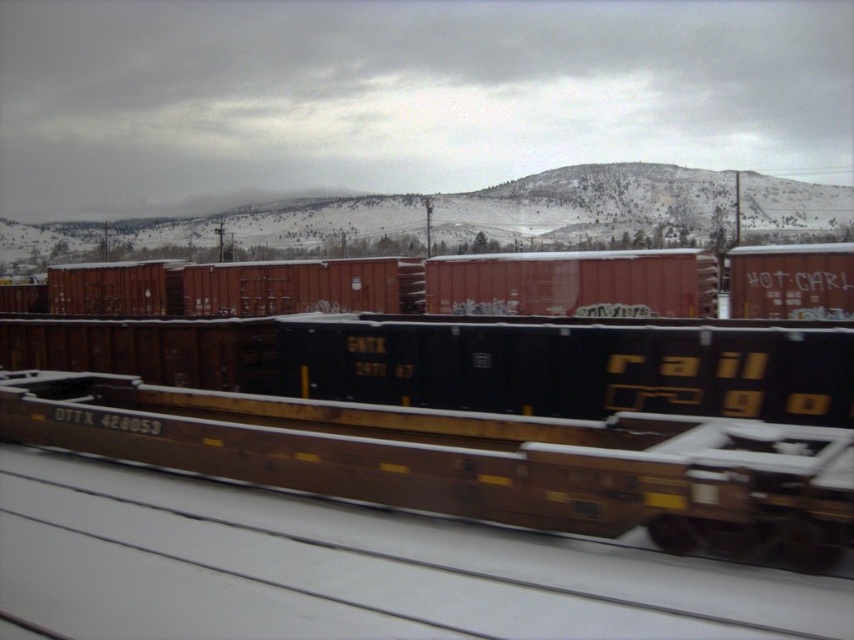
Is point (297, 388) more distant than point (295, 262)?

That is False.

Find the location of a particular element. The height and width of the screenshot is (640, 854). rusty metal train car at center is located at coordinates (471, 362).

Image resolution: width=854 pixels, height=640 pixels. I want to click on brown matte train car at center, so click(477, 461).

From the picture: Is brown matte train car at center wider than rusty metal train car at center?

No.

The width and height of the screenshot is (854, 640). What do you see at coordinates (477, 461) in the screenshot?
I see `brown matte train car at center` at bounding box center [477, 461].

Locate an element on the screen. The height and width of the screenshot is (640, 854). brown matte train car at center is located at coordinates (477, 461).

Is brown matte train car at center to the left of matte red container at center from the viewer's perspective?

In fact, brown matte train car at center is to the right of matte red container at center.

The width and height of the screenshot is (854, 640). What do you see at coordinates (477, 461) in the screenshot?
I see `brown matte train car at center` at bounding box center [477, 461].

Which is in front, point (603, 483) or point (779, 246)?

Point (603, 483) is more forward.

Locate an element on the screen. This screenshot has height=640, width=854. brown matte train car at center is located at coordinates (477, 461).